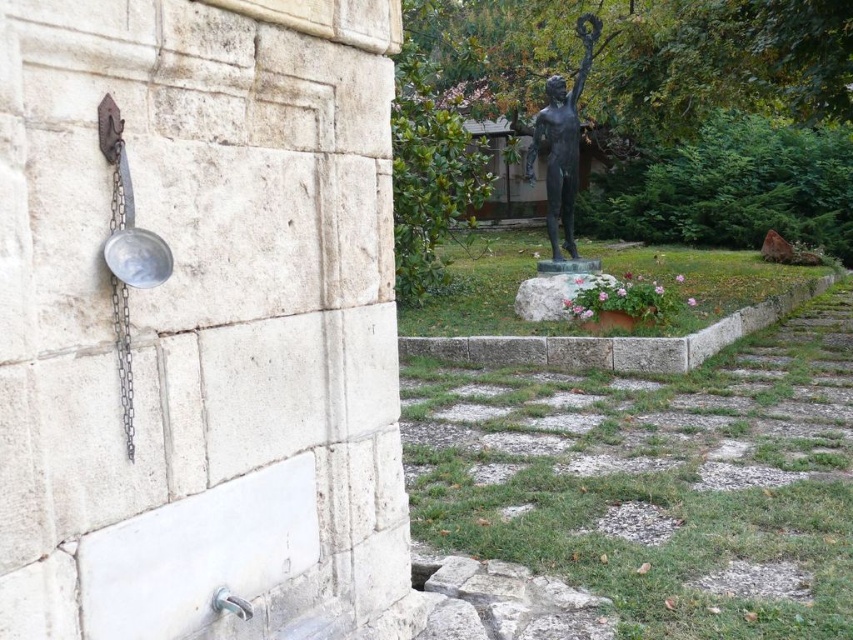
Which is more to the left, bronze statue at center or white stone at center?

Positioned to the left is white stone at center.

Who is shorter, bronze statue at center or white stone at center?

white stone at center

Is point (578, 68) less distant than point (549, 301)?

No.

This screenshot has width=853, height=640. I want to click on bronze statue at center, so click(560, 141).